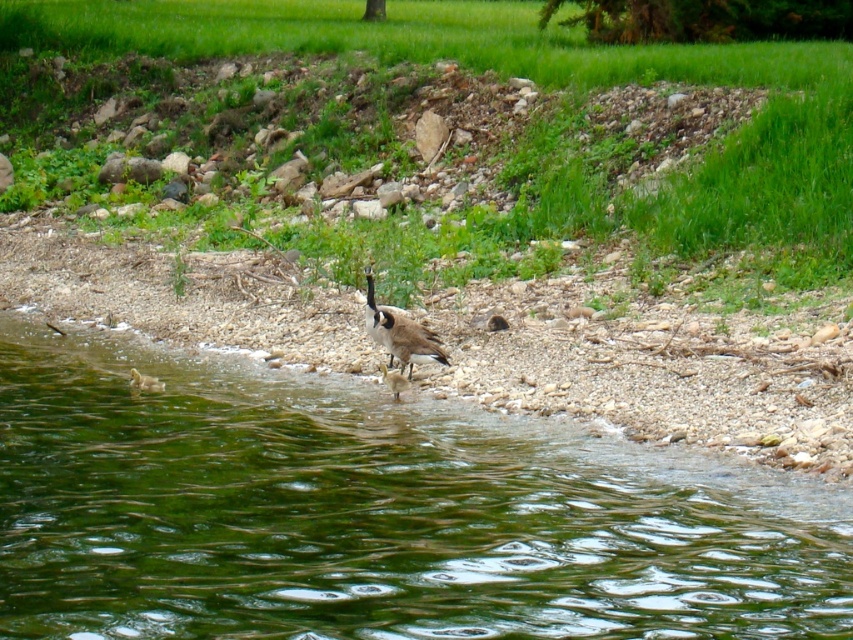
In the scene shown: You are a hiker who wants to cross from the green grass at upper center to the brown fuzzy duckling at lower left. The path between them is rocky and uneven. Given that the distance between them is 47.15 feet, can you estimate how long it would take you to walk this distance if your average walking speed is 3 feet per second?

The distance between the green grass at upper center and the brown fuzzy duckling at lower left is 47.15 feet. At an average walking speed of 3 feet per second, it would take approximately 15.7 seconds to cross the distance. Since the path is rocky and uneven, you should proceed with caution but the time estimate remains accurate based on the given speed.

You are a small bird flying over the scene and want to land on a safe spot. You see the green grass at upper center and the brown fuzzy duckling at center. Which location is higher up in the image?

The green grass at upper center is located above the brown fuzzy duckling at center, so it is higher up in the image.